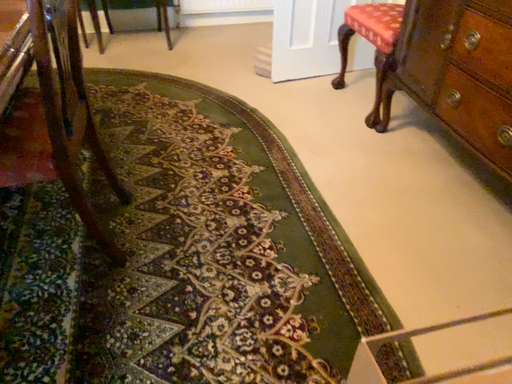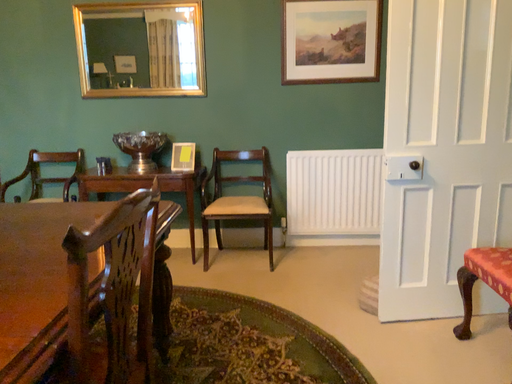
Question: How did the camera likely rotate when shooting the video?

Choices:
 (A) rotated left
 (B) rotated right

Answer: (A)